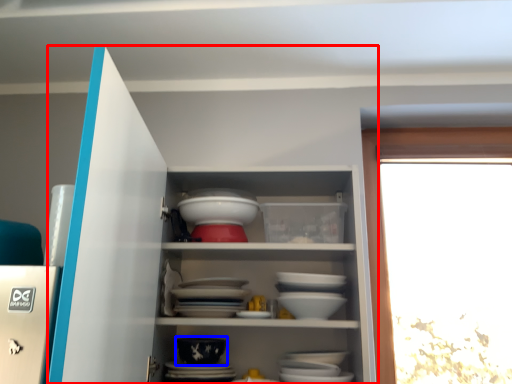
Question: Which object appears closest to the camera in this image, cupboard (highlighted by a red box) or bowl (highlighted by a blue box)?

Choices:
 (A) cupboard
 (B) bowl

Answer: (A)